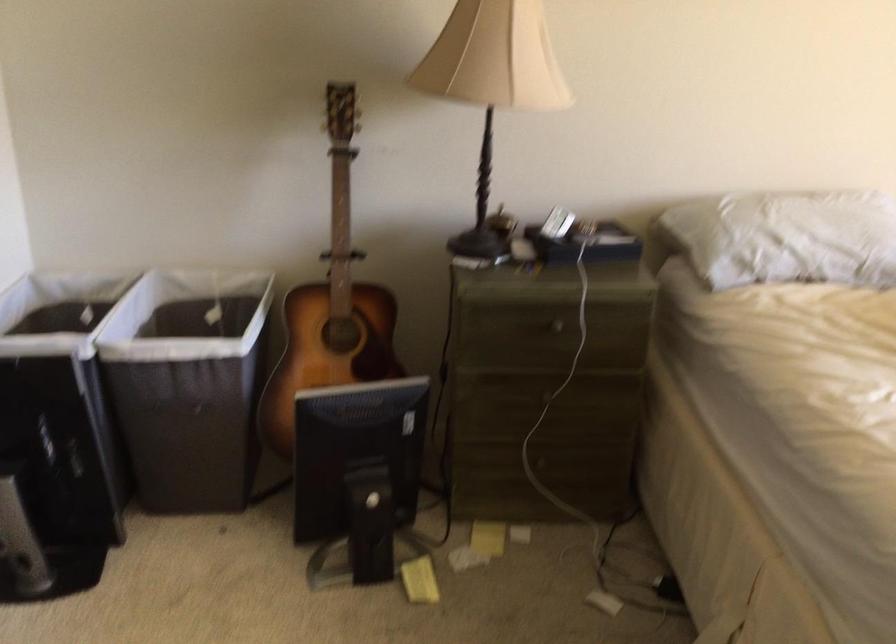
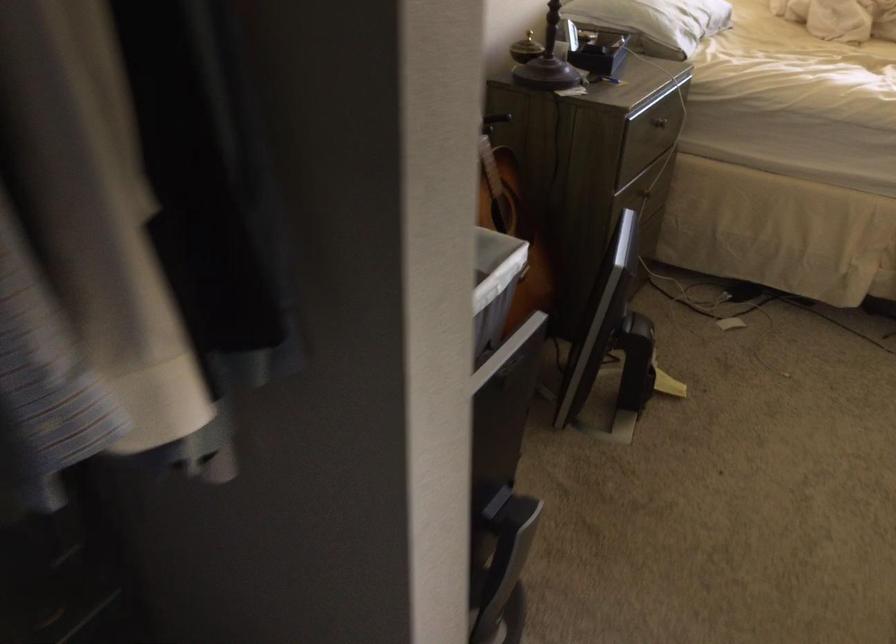
Find the pixel in the second image that matches point 188,346 in the first image.

(494, 286)